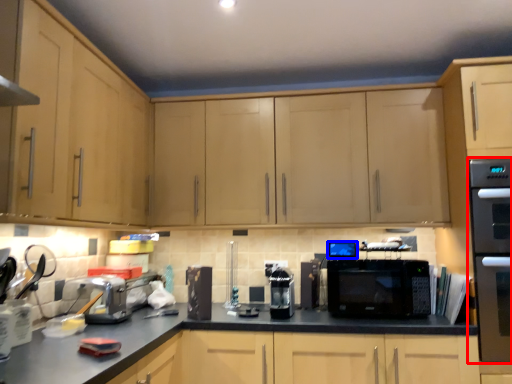
Question: Among these objects, which one is farthest to the camera, home appliance (highlighted by a red box) or appliance (highlighted by a blue box)?

Choices:
 (A) home appliance
 (B) appliance

Answer: (B)